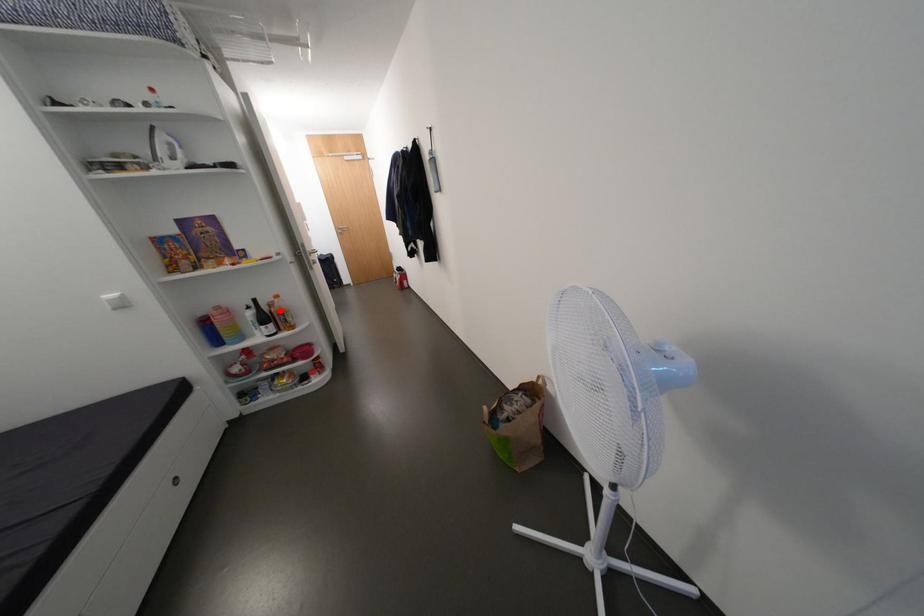
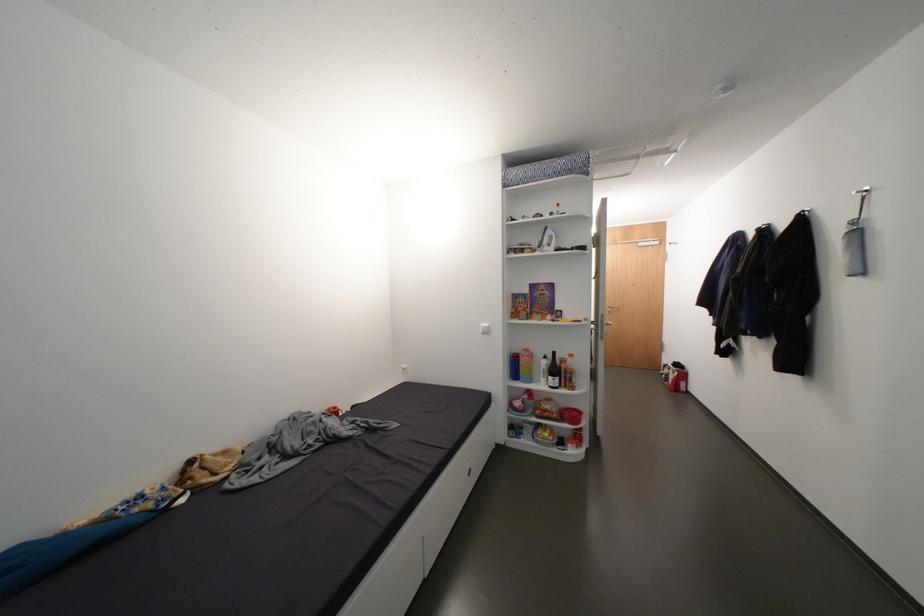
Question: A red point is marked in image1. In image2, is the corresponding 3D point closer to the camera or farther? Reply with the corresponding letter.

Choices:
 (A) The corresponding 3D point is closer.
 (B) The corresponding 3D point is farther.

Answer: (B)